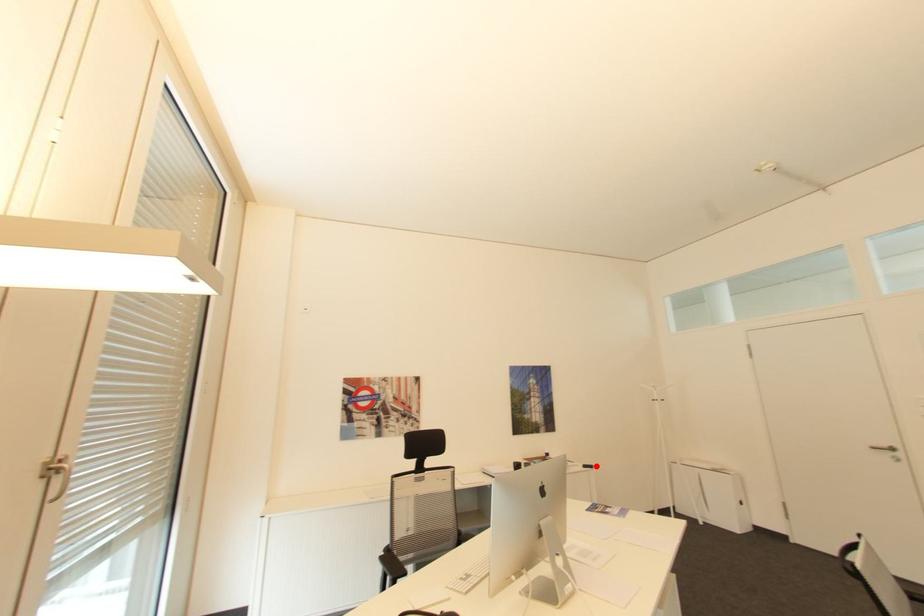
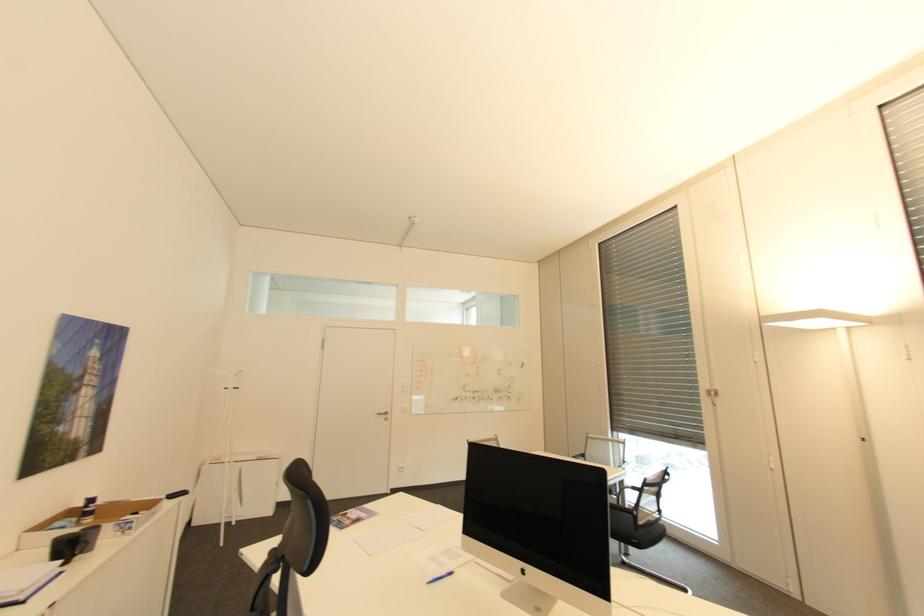
The point at the highlighted location is marked in the first image. Where is the corresponding point in the second image?

(188, 493)